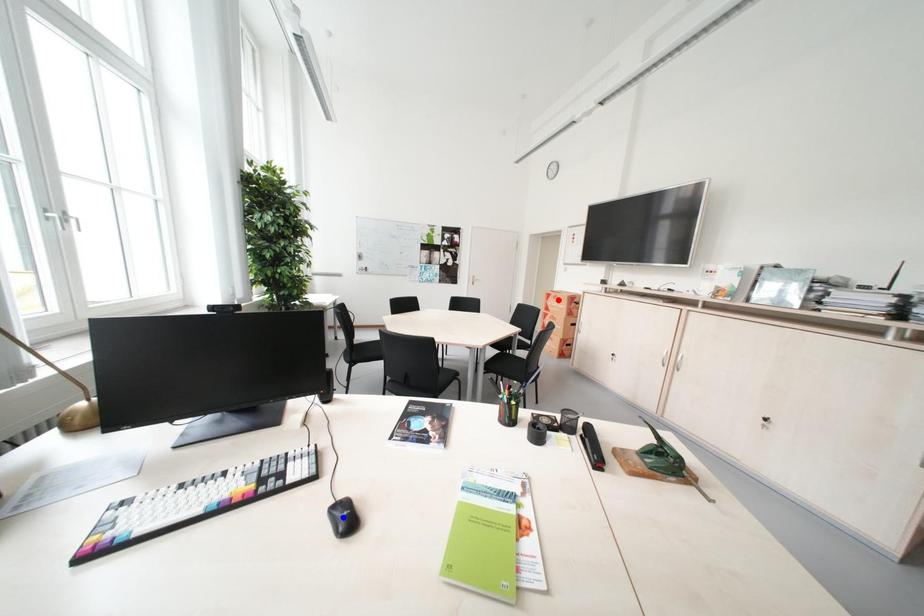
Question: In the image, two points are highlighted. Which point is nearer to the camera? Reply with the corresponding letter.

Choices:
 (A) blue point
 (B) red point

Answer: (A)